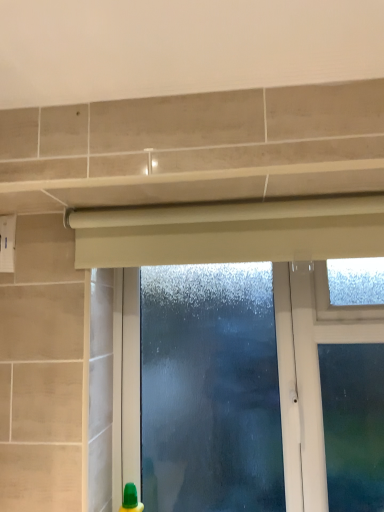
Question: Is frosted glass window at center taller or shorter than beige matte curtain at upper center?

Choices:
 (A) tall
 (B) short

Answer: (A)

Question: Is frosted glass window at center to the left or to the right of beige matte curtain at upper center in the image?

Choices:
 (A) right
 (B) left

Answer: (A)

Question: In the image, is frosted glass window at center positioned in front of or behind beige matte curtain at upper center?

Choices:
 (A) front
 (B) behind

Answer: (B)

Question: From the image's perspective, is beige matte curtain at upper center located above or below frosted glass window at center?

Choices:
 (A) above
 (B) below

Answer: (A)

Question: Relative to frosted glass window at center, is beige matte curtain at upper center in front or behind?

Choices:
 (A) behind
 (B) front

Answer: (B)

Question: From a real-world perspective, relative to frosted glass window at center, is beige matte curtain at upper center vertically above or below?

Choices:
 (A) below
 (B) above

Answer: (B)

Question: Do you think beige matte curtain at upper center is within frosted glass window at center, or outside of it?

Choices:
 (A) outside
 (B) inside

Answer: (A)